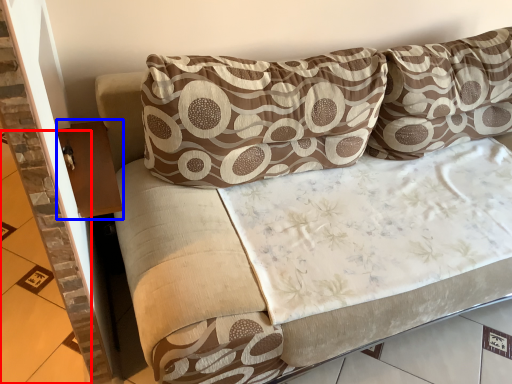
Question: Which object appears closest to the camera in this image, tile (highlighted by a red box) or table (highlighted by a blue box)?

Choices:
 (A) tile
 (B) table

Answer: (B)